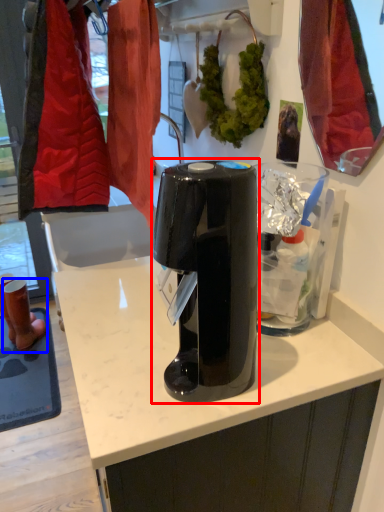
Question: Which object is closer to the camera taking this photo, home appliance (highlighted by a red box) or footwear (highlighted by a blue box)?

Choices:
 (A) home appliance
 (B) footwear

Answer: (A)